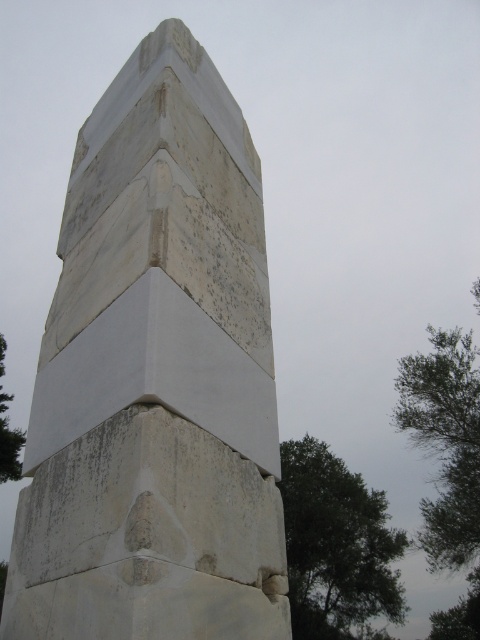
Who is higher up, green leafy tree at right or green leafy tree at lower left?

green leafy tree at lower left is higher up.

Which is more to the left, green leafy tree at right or green leafy tree at lower left?

green leafy tree at lower left

At what (x,y) coordinates should I click in order to perform the action: click on green leafy tree at right. Please return your answer as a coordinate pair (x, y). This screenshot has width=480, height=640. Looking at the image, I should click on (336, 545).

Find the location of a particular element. green leafy tree at right is located at coordinates (336, 545).

Consider the image. Is white stone monument at center to the left of green leafy tree at lower left from the viewer's perspective?

Incorrect, white stone monument at center is not on the left side of green leafy tree at lower left.

Can you confirm if white stone monument at center is wider than green leafy tree at lower left?

No, white stone monument at center is not wider than green leafy tree at lower left.

Where is `white stone monument at center`? The image size is (480, 640). white stone monument at center is located at coordinates (156, 378).

Where is `white stone monument at center`? This screenshot has height=640, width=480. white stone monument at center is located at coordinates (156, 378).

This screenshot has width=480, height=640. Find the location of `white stone monument at center`. white stone monument at center is located at coordinates (156, 378).